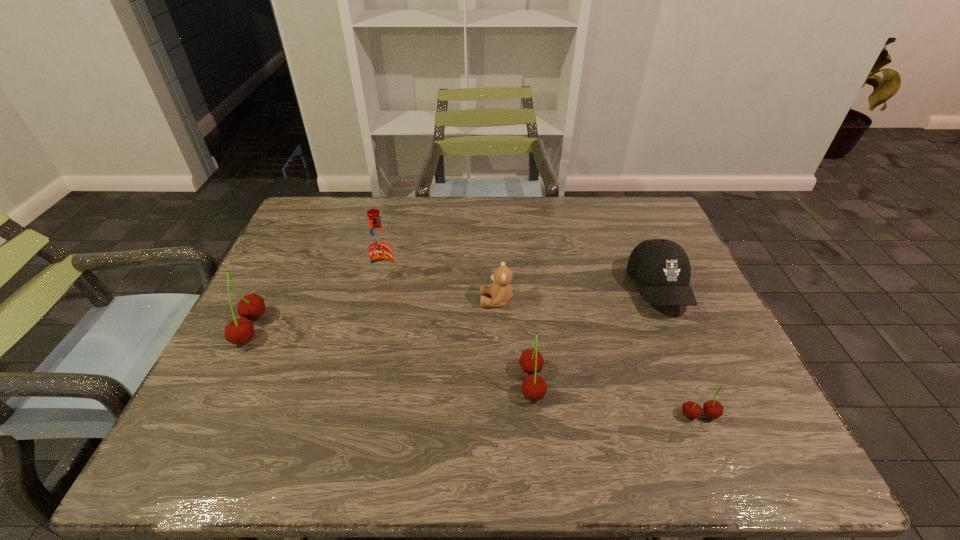
Where is `the leftmost cherry`? the leftmost cherry is located at coordinates (239, 331).

Image resolution: width=960 pixels, height=540 pixels. I want to click on the leftmost object, so click(239, 331).

What are the coordinates of `the third tallest object` in the screenshot? It's located at (534, 388).

Where is `the second tallest cherry`? This screenshot has height=540, width=960. the second tallest cherry is located at coordinates (534, 388).

At what (x,y) coordinates should I click in order to perform the action: click on the shortest cherry. Please return your answer as a coordinate pair (x, y). This screenshot has height=540, width=960. Looking at the image, I should click on (713, 409).

Locate an element on the screen. baseball cap is located at coordinates (661, 269).

At what (x,y) coordinates should I click in order to perform the action: click on root beer. Please return your answer as a coordinate pair (x, y). Looking at the image, I should click on (380, 252).

Find the location of `the tallest object`. the tallest object is located at coordinates (380, 252).

In order to click on teddy bear in this screenshot , I will do `click(501, 291)`.

Image resolution: width=960 pixels, height=540 pixels. Find the location of `vacant space located on the surface of the leftmost cherry`. vacant space located on the surface of the leftmost cherry is located at coordinates (318, 329).